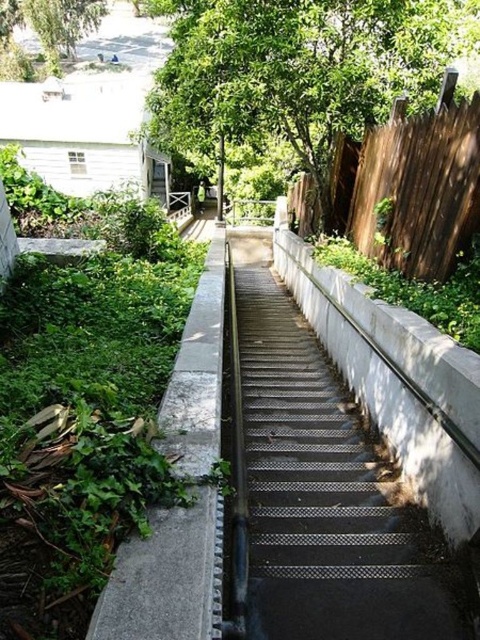
You are carrying a large painting that is 1.5 meters wide. You need to walk up the metallic mesh stairs at center while staying close to the gray concrete wall at left. Is there enough space between the stairs and the wall for the painting to fit?

The metallic mesh stairs at center might be wider than gray concrete wall at left, so there may not be enough space between them for the painting to fit. It is uncertain and requires further measurement.

You are standing at the bottom of the staircase and want to know how far the gray concrete wall at left is from you. Can you determine the distance?

The gray concrete wall at left is 4.00 feet away from the viewer.